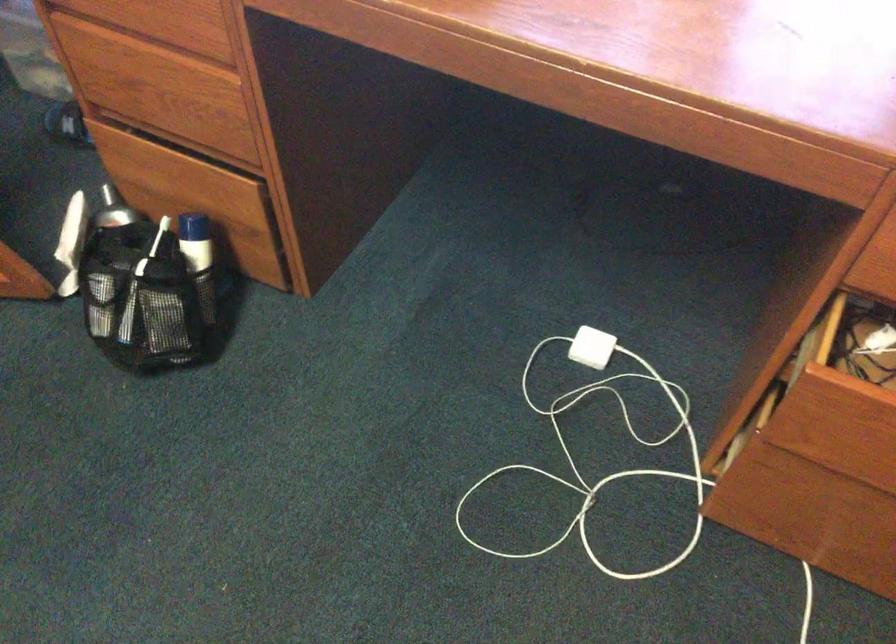
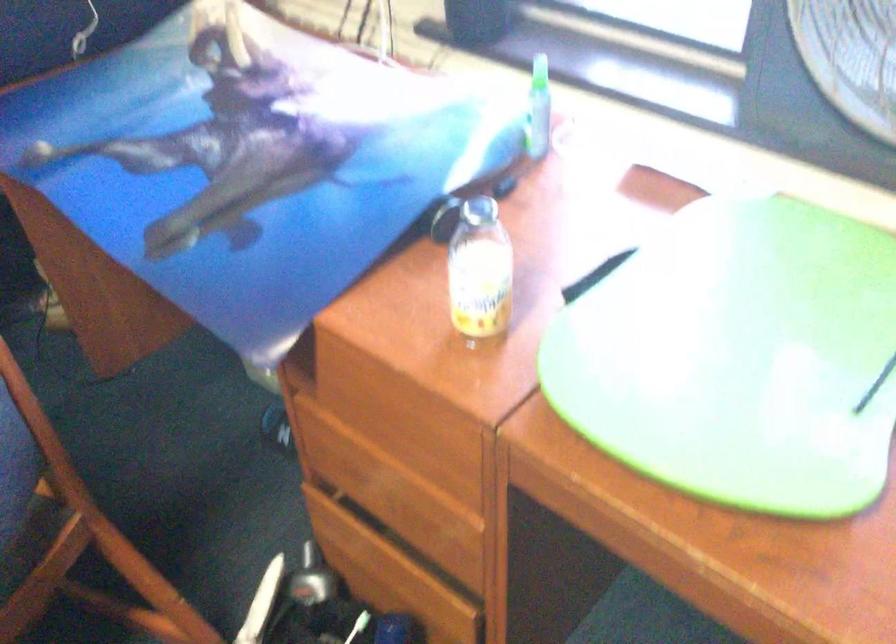
Question: How did the camera likely rotate?

Choices:
 (A) Left
 (B) Right
 (C) Up
 (D) Down

Answer: (A)